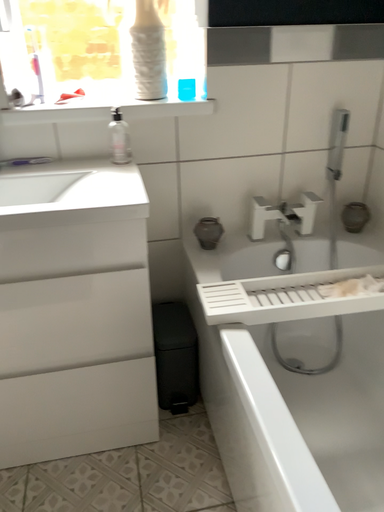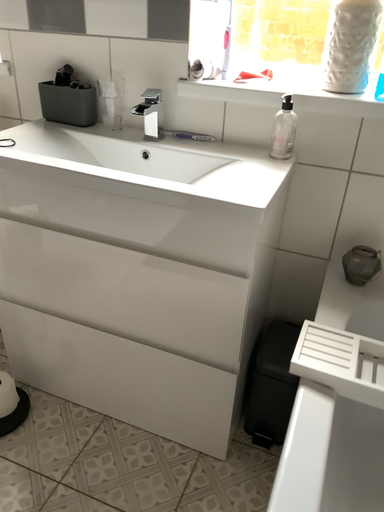
Question: Which way did the camera rotate in the video?

Choices:
 (A) rotated right
 (B) rotated left

Answer: (B)